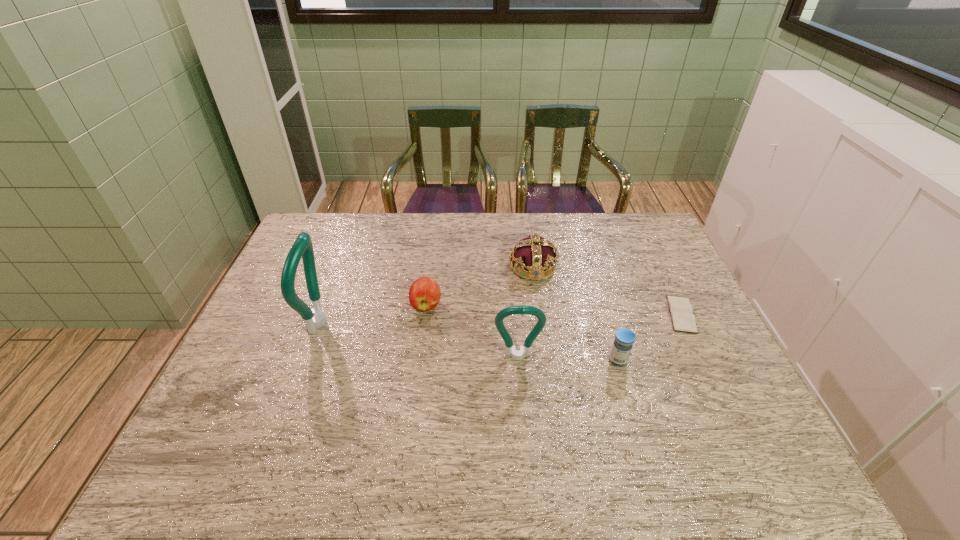
Locate an element on the screen. vacant space at the near edge of the desktop is located at coordinates (679, 403).

The image size is (960, 540). I want to click on vacant space at the left edge of the desktop, so click(226, 374).

Identify the location of free region at the right edge of the desktop. (653, 316).

Image resolution: width=960 pixels, height=540 pixels. I want to click on vacant region at the near right corner of the desktop, so click(747, 419).

At what (x,y) coordinates should I click in order to perform the action: click on vacant space that is in between the diary and the apple. Please return your answer as a coordinate pair (x, y). Image resolution: width=960 pixels, height=540 pixels. Looking at the image, I should click on (554, 310).

At what (x,y) coordinates should I click in order to perform the action: click on vacant area that lies between the apple and the fifth object from left to right. Please return your answer as a coordinate pair (x, y). The height and width of the screenshot is (540, 960). Looking at the image, I should click on (522, 333).

Locate an element on the screen. Image resolution: width=960 pixels, height=540 pixels. vacant space that's between the shortest object and the medicine is located at coordinates (649, 338).

This screenshot has height=540, width=960. Identify the location of free space between the medicine and the second object from left to right. (522, 333).

You are a GUI agent. You are given a task and a screenshot of the screen. Output one action in this format:
    pyautogui.click(x=<x>, y=<y>)
    Task: Click on the empty space that is in between the shortest object and the fourth shortest object
    
    Given the screenshot: What is the action you would take?
    pyautogui.click(x=607, y=291)

Locate an element on the screen. This screenshot has height=540, width=960. free space between the third tallest object and the apple is located at coordinates (479, 286).